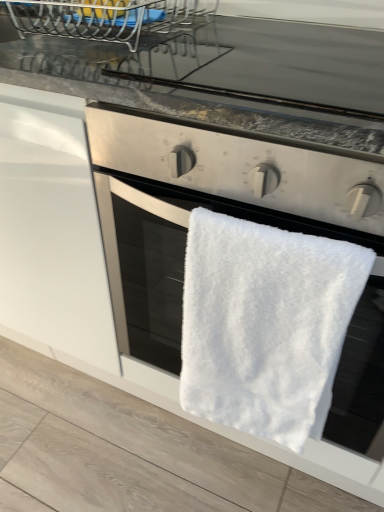
Question: Does black glass at upper center have a lesser height compared to white fluffy towel at center?

Choices:
 (A) yes
 (B) no

Answer: (A)

Question: From a real-world perspective, does black glass at upper center sit lower than white fluffy towel at center?

Choices:
 (A) yes
 (B) no

Answer: (B)

Question: Is black glass at upper center beside white fluffy towel at center?

Choices:
 (A) yes
 (B) no

Answer: (B)

Question: Does black glass at upper center have a lesser width compared to white fluffy towel at center?

Choices:
 (A) yes
 (B) no

Answer: (B)

Question: Is black glass at upper center positioned before white fluffy towel at center?

Choices:
 (A) no
 (B) yes

Answer: (A)

Question: From a real-world perspective, is black glass at upper center located higher than white fluffy towel at center?

Choices:
 (A) yes
 (B) no

Answer: (A)

Question: From a real-world perspective, is white fluffy towel at center beneath black glass at upper center?

Choices:
 (A) yes
 (B) no

Answer: (A)

Question: Can you confirm if white fluffy towel at center is taller than black glass at upper center?

Choices:
 (A) yes
 (B) no

Answer: (A)

Question: Is white fluffy towel at center surrounding black glass at upper center?

Choices:
 (A) no
 (B) yes

Answer: (A)

Question: Is white fluffy towel at center positioned far away from black glass at upper center?

Choices:
 (A) no
 (B) yes

Answer: (A)

Question: Can you confirm if white fluffy towel at center is smaller than black glass at upper center?

Choices:
 (A) yes
 (B) no

Answer: (B)

Question: Is white fluffy towel at center shorter than black glass at upper center?

Choices:
 (A) no
 (B) yes

Answer: (A)

Question: Is point (339, 345) closer or farther from the camera than point (322, 141)?

Choices:
 (A) closer
 (B) farther

Answer: (B)